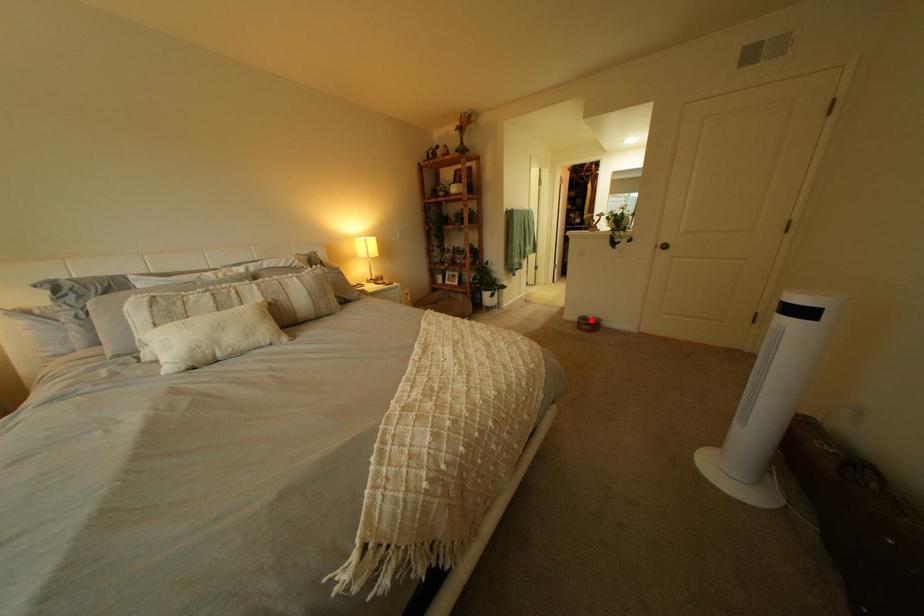
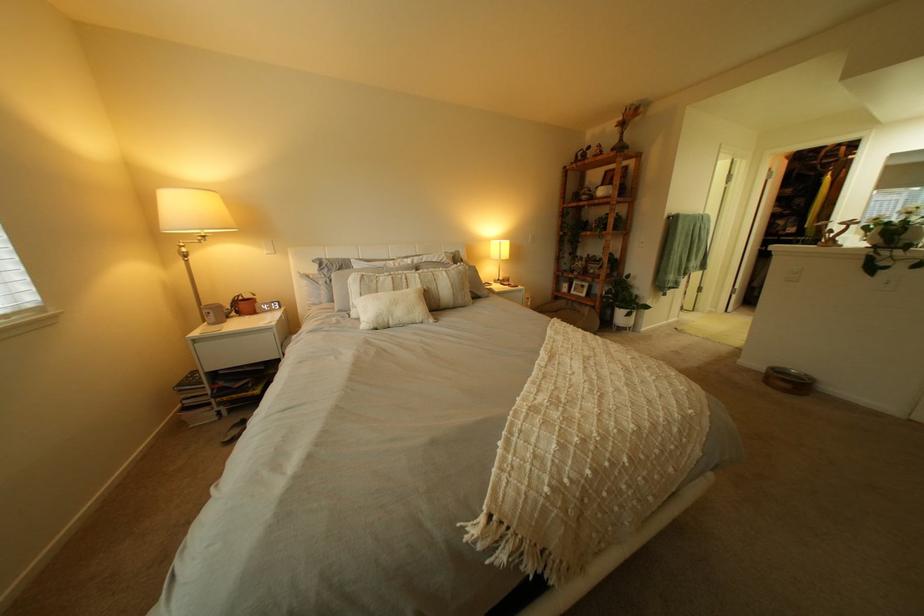
Locate, in the second image, the point that corresponds to the highlighted location in the first image.

(779, 369)